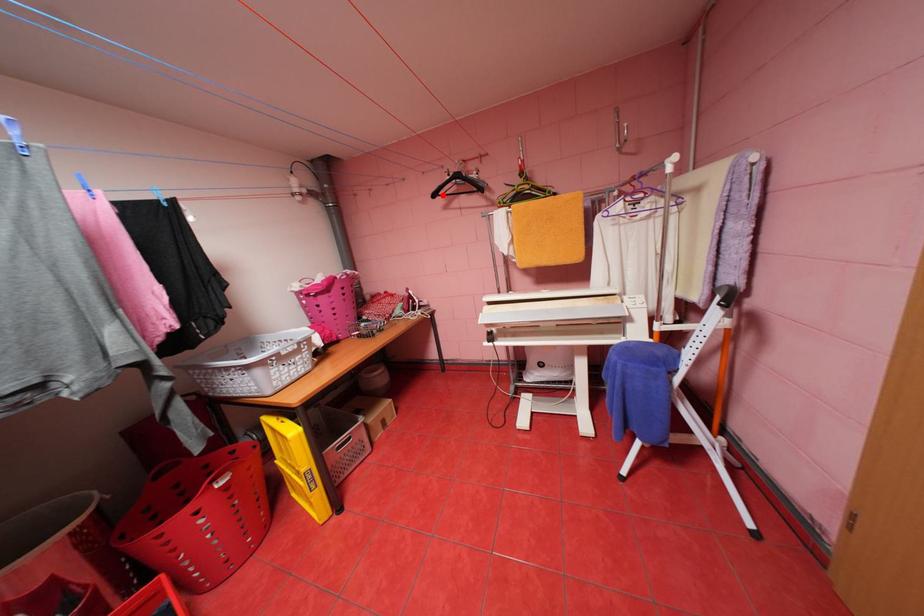
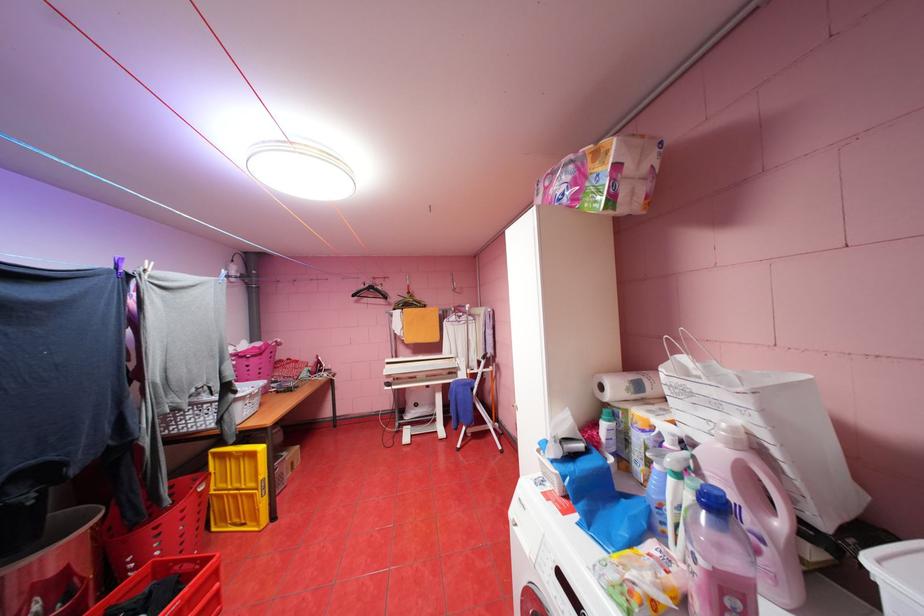
Find the pixel in the second image that matches the highlighted location in the first image.

(361, 294)